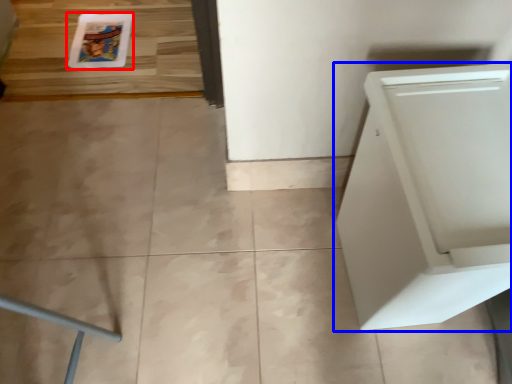
Question: Among these objects, which one is farthest to the camera, comic book (highlighted by a red box) or home appliance (highlighted by a blue box)?

Choices:
 (A) comic book
 (B) home appliance

Answer: (A)